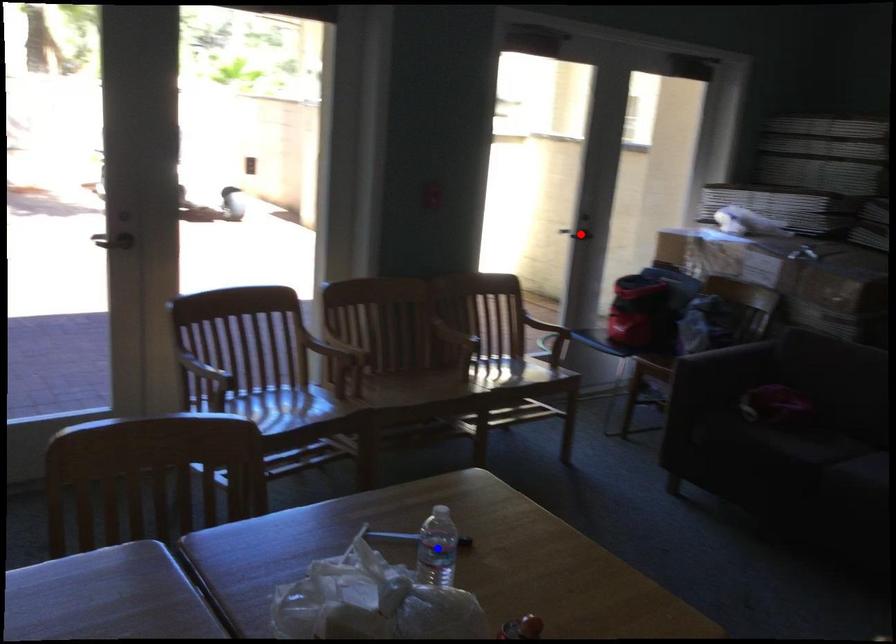
Question: Two points are marked on the image. Which point is closer to the camera?

Choices:
 (A) Blue point is closer.
 (B) Red point is closer.

Answer: (A)